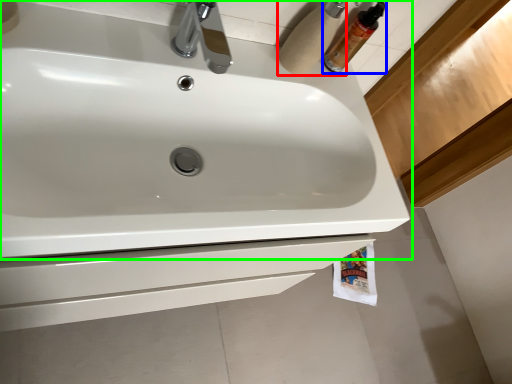
Question: Which object is positioned closest to toilet paper (highlighted by a red box)? Select from mouthwash (highlighted by a blue box) and sink (highlighted by a green box).

Choices:
 (A) mouthwash
 (B) sink

Answer: (A)